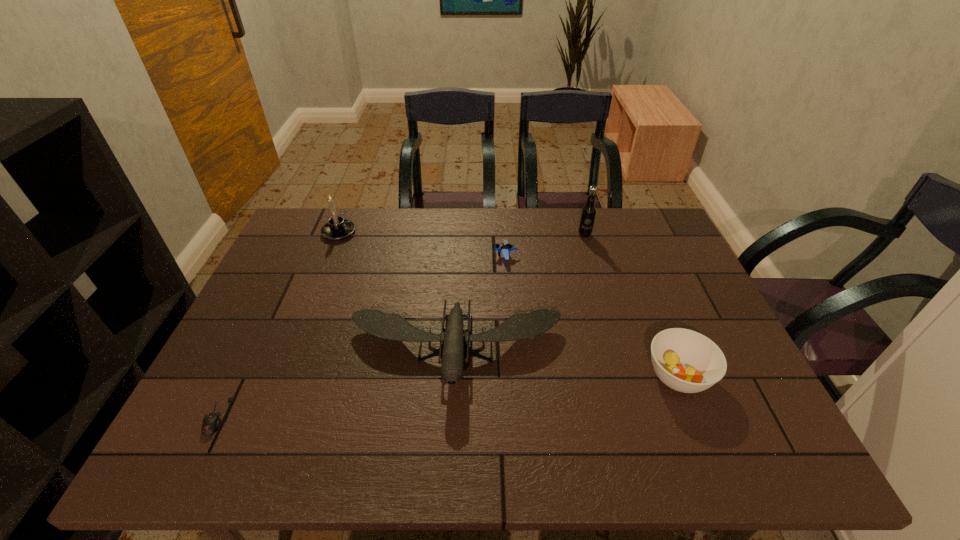
The height and width of the screenshot is (540, 960). I want to click on the fifth object from left to right, so click(588, 213).

At what (x,y) coordinates should I click in order to perform the action: click on root beer. Please return your answer as a coordinate pair (x, y). Image resolution: width=960 pixels, height=540 pixels. Looking at the image, I should click on (588, 213).

At what (x,y) coordinates should I click in order to perform the action: click on candle holder. Please return your answer as a coordinate pair (x, y). Looking at the image, I should click on click(337, 228).

Locate an element on the screen. Image resolution: width=960 pixels, height=540 pixels. the second tallest object is located at coordinates (337, 228).

Image resolution: width=960 pixels, height=540 pixels. Identify the location of drone. (392, 326).

You are a GUI agent. You are given a task and a screenshot of the screen. Output one action in this format:
    pyautogui.click(x=<x>, y=<y>)
    Task: Click on the rightmost object
    
    Given the screenshot: What is the action you would take?
    pyautogui.click(x=686, y=361)

Locate an element on the screen. soup bowl is located at coordinates (686, 361).

Identify the location of Lego. (505, 248).

I want to click on the second shortest object, so click(x=505, y=248).

This screenshot has width=960, height=540. I want to click on the shortest object, so click(x=211, y=422).